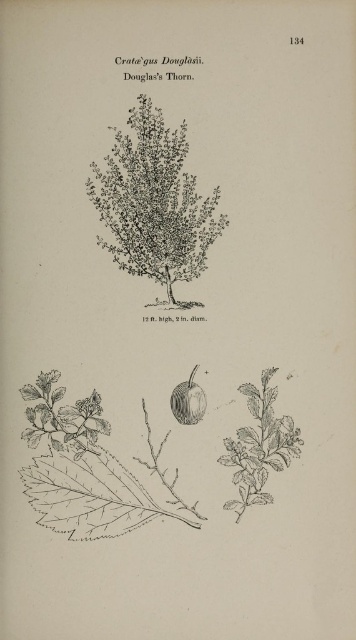
Question: Among these points, which one is farthest from the camera?

Choices:
 (A) (102, 193)
 (B) (186, 396)

Answer: (A)

Question: Is grayish-green textured bush at center wider than smooth green apple at center?

Choices:
 (A) yes
 (B) no

Answer: (A)

Question: Which point appears closest to the camera in this image?

Choices:
 (A) (201, 404)
 (B) (171, 148)

Answer: (B)

Question: Which point is farther to the camera?

Choices:
 (A) (205, 397)
 (B) (174, 188)

Answer: (A)

Question: Can you confirm if grayish-green textured bush at center is positioned above smooth green apple at center?

Choices:
 (A) no
 (B) yes

Answer: (B)

Question: Is grayish-green textured bush at center positioned in front of smooth green apple at center?

Choices:
 (A) no
 (B) yes

Answer: (B)